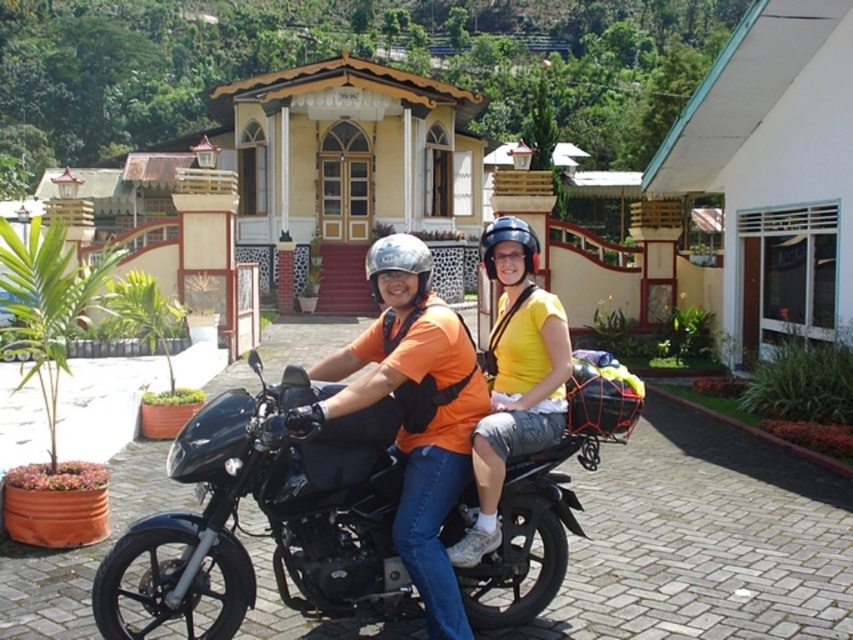
Question: Is black matte motorcycle at center to the left of matte black helmet at center from the viewer's perspective?

Choices:
 (A) yes
 (B) no

Answer: (A)

Question: Estimate the real-world distances between objects in this image. Which object is closer to the matte black helmet at center?

Choices:
 (A) metallic silver helmet at center
 (B) black matte motorcycle at center
 (C) yellow matte helmet at center

Answer: (C)

Question: Considering the real-world distances, which object is closest to the matte black helmet at center?

Choices:
 (A) metallic silver helmet at center
 (B) orange fabric shirt at center
 (C) yellow matte helmet at center

Answer: (B)

Question: From the image, what is the correct spatial relationship of yellow matte helmet at center in relation to metallic silver helmet at center?

Choices:
 (A) right
 (B) left

Answer: (A)

Question: Which object is farther from the camera taking this photo?

Choices:
 (A) black matte motorcycle at center
 (B) matte black helmet at center

Answer: (B)

Question: Is orange fabric shirt at center wider than matte black helmet at center?

Choices:
 (A) yes
 (B) no

Answer: (A)